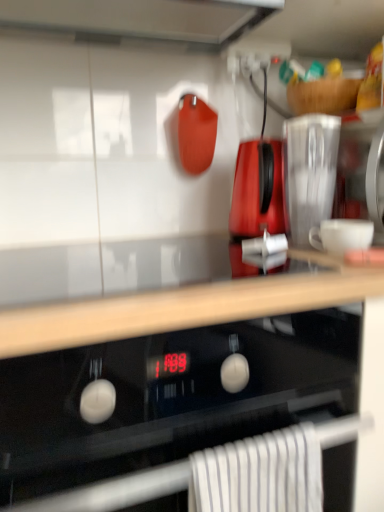
Question: Which direction should I rotate to face glossy plastic kettle at center, arranged as the 2th kitchen appliance when viewed from the right, — up or down?

Choices:
 (A) down
 (B) up

Answer: (B)

Question: Considering the relative sizes of black glass oven at center and wooden at upper center in the image provided, is black glass oven at center wider than wooden at upper center?

Choices:
 (A) yes
 (B) no

Answer: (A)

Question: Is black glass oven at center in front of wooden at upper center?

Choices:
 (A) no
 (B) yes

Answer: (B)

Question: From the image's perspective, is black glass oven at center located above wooden at upper center?

Choices:
 (A) yes
 (B) no

Answer: (B)

Question: Can you confirm if black glass oven at center is taller than wooden at upper center?

Choices:
 (A) no
 (B) yes

Answer: (B)

Question: Is black glass oven at center aimed at wooden at upper center?

Choices:
 (A) no
 (B) yes

Answer: (A)

Question: Is wooden at upper center at the back of black glass oven at center?

Choices:
 (A) yes
 (B) no

Answer: (B)

Question: Is wooden at upper center closer to the viewer compared to black glass oven at center?

Choices:
 (A) yes
 (B) no

Answer: (B)

Question: Can you confirm if wooden at upper center is positioned to the left of black glass oven at center?

Choices:
 (A) yes
 (B) no

Answer: (B)

Question: Is wooden at upper center taller than black glass oven at center?

Choices:
 (A) no
 (B) yes

Answer: (A)

Question: Does wooden at upper center have a greater width compared to black glass oven at center?

Choices:
 (A) yes
 (B) no

Answer: (B)

Question: Could black glass oven at center be considered to be inside wooden at upper center?

Choices:
 (A) no
 (B) yes

Answer: (A)

Question: Is wooden at upper center completely or partially outside of black glass oven at center?

Choices:
 (A) no
 (B) yes

Answer: (B)

Question: Could wooden at upper center be considered to be inside white striped towel at lower center?

Choices:
 (A) yes
 (B) no

Answer: (B)